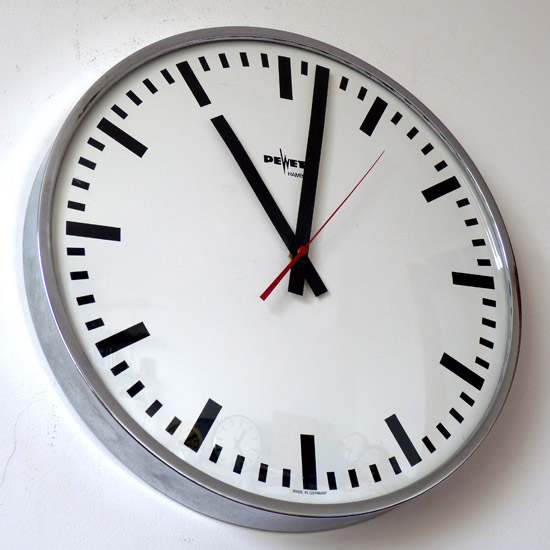
Where is `clock`? The image size is (550, 550). clock is located at coordinates (410, 383).